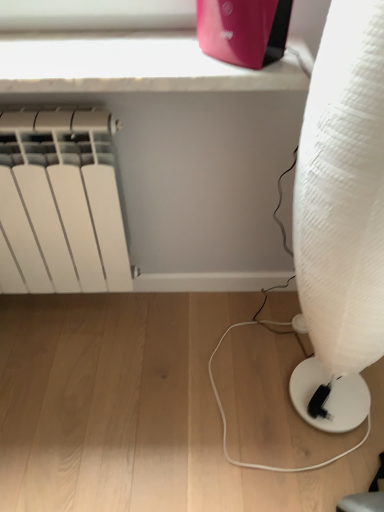
Measure the distance between white marble window sill at upper center and camera.

white marble window sill at upper center and camera are 76.57 centimeters apart.

Identify the location of white matte radiator at left. (62, 202).

Measure the distance between matte pink router at upper center and camera.

They are 27.59 inches apart.

Where is `white textured lamp at right`? Image resolution: width=384 pixels, height=512 pixels. white textured lamp at right is located at coordinates (342, 214).

I want to click on white marble window sill at upper center, so click(138, 66).

Considering the relative sizes of white matte radiator at left and white textured lamp at right in the image provided, is white matte radiator at left thinner than white textured lamp at right?

Yes.

Is white matte radiator at left facing towards white textured lamp at right?

No, white matte radiator at left is not aimed at white textured lamp at right.

From a real-world perspective, between white matte radiator at left and white textured lamp at right, who is vertically lower?

From a 3D spatial view, white matte radiator at left is below.

Where is `window sill behind the matte pink router at upper center`? This screenshot has height=512, width=384. window sill behind the matte pink router at upper center is located at coordinates (138, 66).

Is white marble window sill at upper center with matte pink router at upper center?

No, white marble window sill at upper center is not making contact with matte pink router at upper center.

Consider the image. Does white marble window sill at upper center appear on the left side of matte pink router at upper center?

Yes.

Which is nearer, (126, 71) or (203, 26)?

The point (126, 71) is more forward.

Could you tell me if matte pink router at upper center is turned towards white marble window sill at upper center?

No, matte pink router at upper center is not aimed at white marble window sill at upper center.

Is white marble window sill at upper center inside matte pink router at upper center?

Actually, white marble window sill at upper center is outside matte pink router at upper center.

In the scene shown: Would you say matte pink router at upper center is a long distance from white marble window sill at upper center?

matte pink router at upper center is actually quite close to white marble window sill at upper center.

Is white textured lamp at right next to white matte radiator at left?

white textured lamp at right is not next to white matte radiator at left, and they're not touching.

Who is smaller, white textured lamp at right or white matte radiator at left?

white matte radiator at left is smaller.

Can you confirm if white textured lamp at right is taller than white matte radiator at left?

Yes, white textured lamp at right is taller than white matte radiator at left.

Considering the relative sizes of white matte radiator at left and white marble window sill at upper center in the image provided, is white matte radiator at left smaller than white marble window sill at upper center?

Incorrect, white matte radiator at left is not smaller in size than white marble window sill at upper center.

Is white matte radiator at left outside of white marble window sill at upper center?

Yes.

Considering the relative sizes of white matte radiator at left and white marble window sill at upper center in the image provided, is white matte radiator at left thinner than white marble window sill at upper center?

Yes.

Does white matte radiator at left lie behind white marble window sill at upper center?

Yes, it is.

Considering the relative positions of white matte radiator at left and matte pink router at upper center in the image provided, is white matte radiator at left behind matte pink router at upper center?

Yes, it is behind matte pink router at upper center.

Can you tell me how much white matte radiator at left and matte pink router at upper center differ in facing direction?

0.545 degrees separate the facing orientations of white matte radiator at left and matte pink router at upper center.

Between point (13, 178) and point (232, 1), which one is positioned behind?

The point (13, 178) is more distant.

Is white matte radiator at left next to matte pink router at upper center?

white matte radiator at left is not next to matte pink router at upper center, and they're not touching.

Are matte pink router at upper center and white textured lamp at right located far from each other?

That's not correct — matte pink router at upper center is a little close to white textured lamp at right.

What's the angular difference between matte pink router at upper center and white textured lamp at right's facing directions?

88.1 degrees.

Which of these two, matte pink router at upper center or white textured lamp at right, is wider?

With larger width is white textured lamp at right.

Is matte pink router at upper center positioned with its back to white textured lamp at right?

No.

Image resolution: width=384 pixels, height=512 pixels. In order to click on radiator above the white textured lamp at right (from the image's perspective) in this screenshot , I will do `click(62, 202)`.

This screenshot has height=512, width=384. Find the location of `window sill located on the left of matte pink router at upper center`. window sill located on the left of matte pink router at upper center is located at coordinates (138, 66).

Considering their positions, is white marble window sill at upper center positioned further to white matte radiator at left than white textured lamp at right?

The object further to white matte radiator at left is white textured lamp at right.

Which object lies further to the anchor point white textured lamp at right, matte pink router at upper center or white matte radiator at left?

Based on the image, white matte radiator at left appears to be further to white textured lamp at right.

Which object lies nearer to the anchor point white matte radiator at left, matte pink router at upper center or white textured lamp at right?

The object closer to white matte radiator at left is matte pink router at upper center.

Consider the image. Estimate the real-world distances between objects in this image. Which object is closer to matte pink router at upper center, white textured lamp at right or white matte radiator at left?

white textured lamp at right.

From the image, which object appears to be farther from white matte radiator at left, matte pink router at upper center or white marble window sill at upper center?

matte pink router at upper center is positioned further to the anchor white matte radiator at left.

Which object lies nearer to the anchor point white textured lamp at right, white marble window sill at upper center or matte pink router at upper center?

Based on the image, matte pink router at upper center appears to be nearer to white textured lamp at right.

Which object lies nearer to the anchor point white textured lamp at right, matte pink router at upper center or white marble window sill at upper center?

matte pink router at upper center.

Considering their positions, is white matte radiator at left positioned further to white marble window sill at upper center than white textured lamp at right?

white textured lamp at right is further to white marble window sill at upper center.

The width and height of the screenshot is (384, 512). Find the location of `window sill located between white matte radiator at left and matte pink router at upper center in the left-right direction`. window sill located between white matte radiator at left and matte pink router at upper center in the left-right direction is located at coordinates (138, 66).

You are a GUI agent. You are given a task and a screenshot of the screen. Output one action in this format:
    pyautogui.click(x=<x>, y=<y>)
    Task: Click on the appliance situated between white matte radiator at left and white textured lamp at right from left to right
    This screenshot has height=512, width=384.
    Given the screenshot: What is the action you would take?
    pyautogui.click(x=243, y=30)

At what (x,y) coordinates should I click in order to perform the action: click on window sill situated between white matte radiator at left and white textured lamp at right from left to right. Please return your answer as a coordinate pair (x, y). Image resolution: width=384 pixels, height=512 pixels. Looking at the image, I should click on (138, 66).

Find the location of a particular element. window sill between matte pink router at upper center and white textured lamp at right vertically is located at coordinates (138, 66).